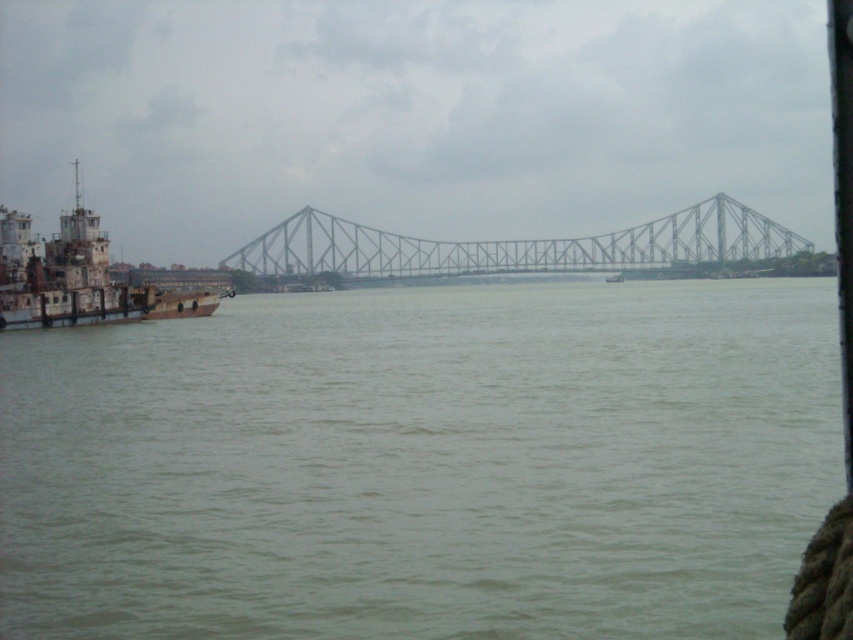
Does rusty metal barge at left come behind metallic gray boat at center?

No.

Does rusty metal barge at left have a smaller size compared to metallic gray boat at center?

Actually, rusty metal barge at left might be larger than metallic gray boat at center.

Measure the distance between rusty metal barge at left and camera.

rusty metal barge at left and camera are 287.58 feet apart from each other.

This screenshot has width=853, height=640. In order to click on rusty metal barge at left in this screenshot , I will do `click(77, 276)`.

Consider the image. Can you confirm if greenish water at center is positioned to the left of metallic gray bridge at center?

Yes, greenish water at center is to the left of metallic gray bridge at center.

Which of these two, greenish water at center or metallic gray bridge at center, stands taller?

metallic gray bridge at center is taller.

Between point (741, 429) and point (735, 241), which one is positioned in front?

Point (741, 429) is more forward.

At what (x,y) coordinates should I click in order to perform the action: click on greenish water at center. Please return your answer as a coordinate pair (x, y). Looking at the image, I should click on (422, 464).

Between greenish water at center and rusty metal barge at left, which one appears on the right side from the viewer's perspective?

From the viewer's perspective, greenish water at center appears more on the right side.

Describe the element at coordinates (422, 464) in the screenshot. This screenshot has width=853, height=640. I see `greenish water at center` at that location.

Identify the location of greenish water at center. Image resolution: width=853 pixels, height=640 pixels. (422, 464).